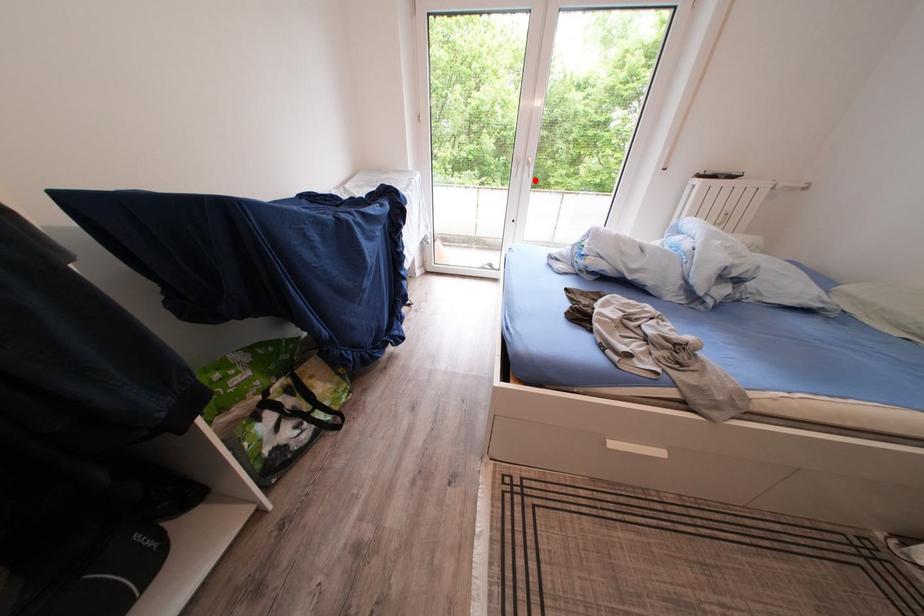
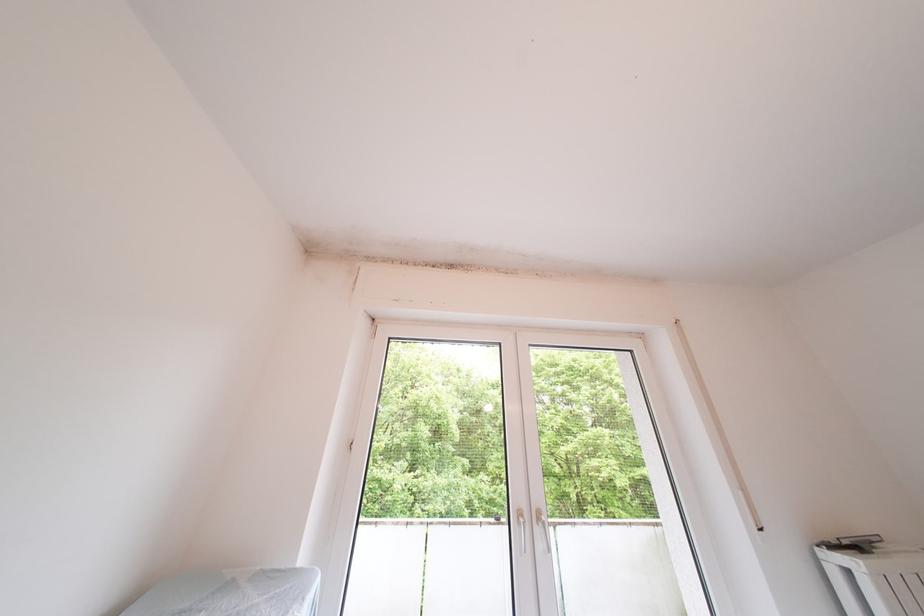
Question: I am providing you with two images of the same scene from different viewpoints. In image1, a red point is highlighted. Considering the same 3D point in image2, which of the following is correct?

Choices:
 (A) It is closer
 (B) It is farther

Answer: (B)